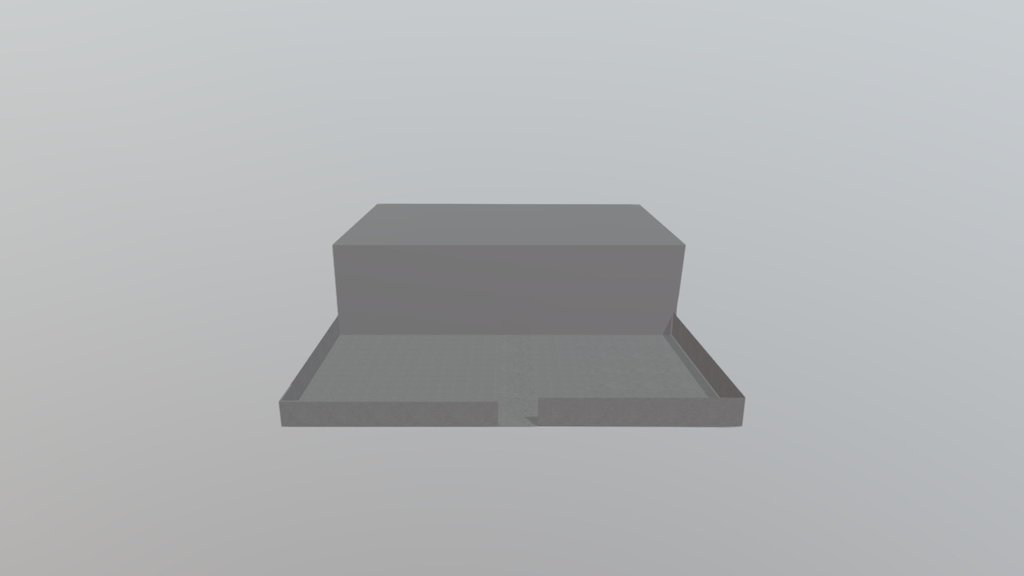
The width and height of the screenshot is (1024, 576). Identify the location of corners. (282, 412), (736, 411), (670, 331), (341, 325), (338, 246), (379, 204), (638, 206), (682, 244).